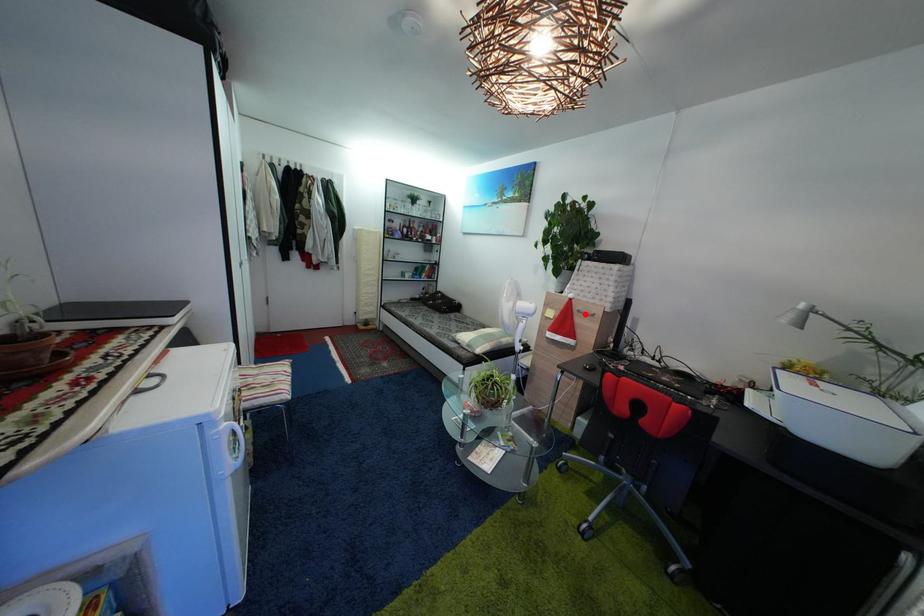
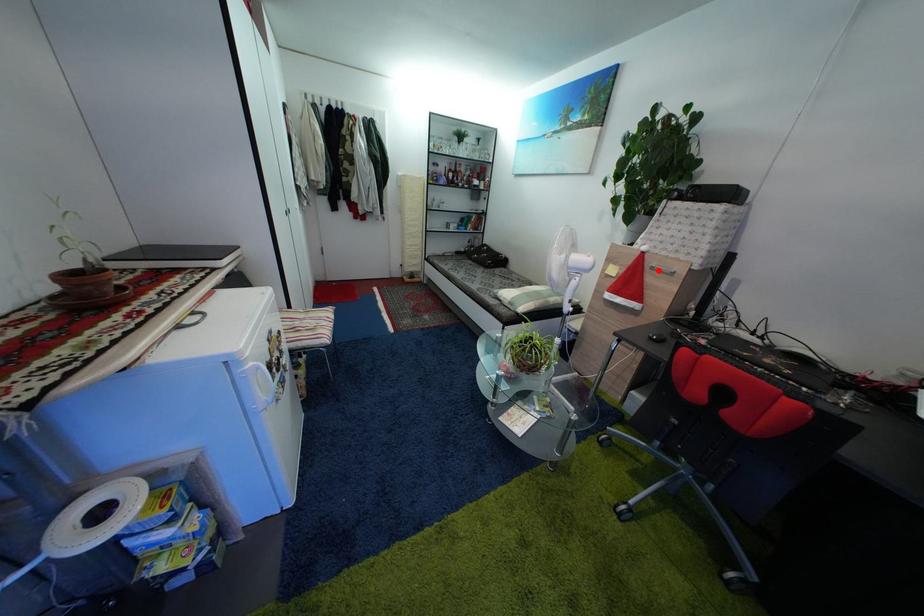
I am providing you with two images of the same scene from different viewpoints. A red point is marked on the first image and another point is marked on the second image. Does the point marked in image1 correspond to the same location as the one in image2?

Yes